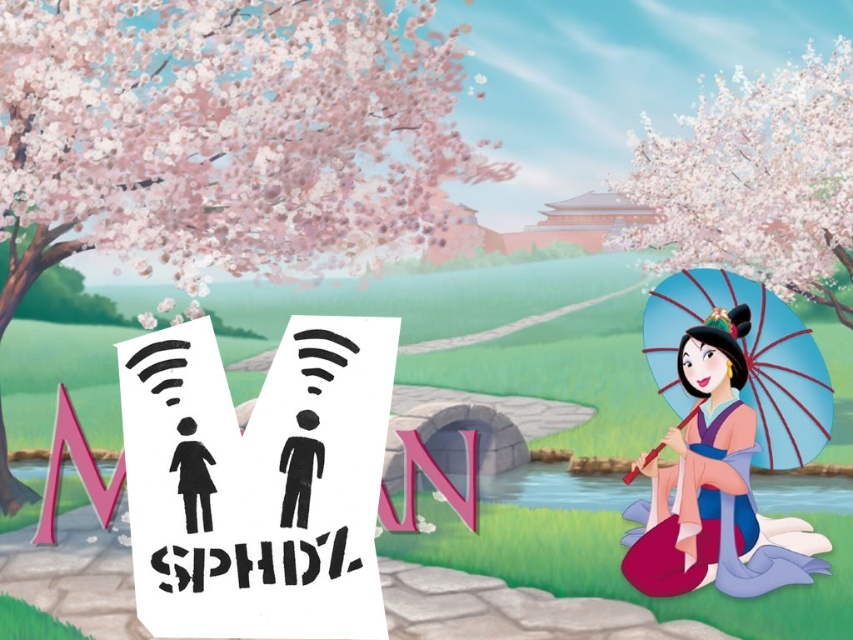
You are walking along the stone pathway in the traditional Chinese setting and see the matte blue umbrella at right and the black paper at center. Which object is positioned farther to the east?

The matte blue umbrella at right is positioned farther to the east because it is to the right of the black paper at center, and in the scene, the stone pathway leads towards the traditional Chinese building which is likely oriented eastward.